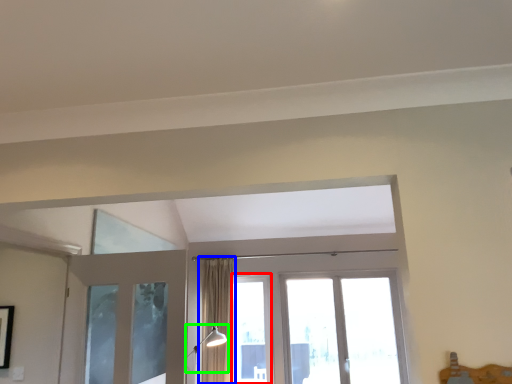
Question: Based on their relative distances, which object is farther from window (highlighted by a red box)? Choose from curtain (highlighted by a blue box) and light fixture (highlighted by a green box).

Choices:
 (A) curtain
 (B) light fixture

Answer: (B)